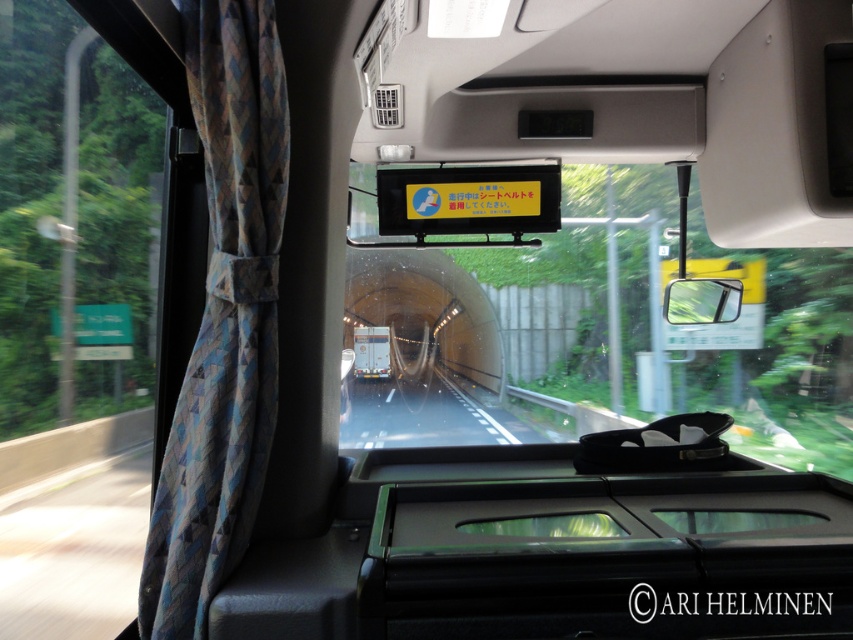
You are a passenger sitting in the bus and looking through the windshield. There are two points marked on the windshield at coordinates point (753, 282) and point (123, 227). Which point is closer to you?

Point (753, 282) is closer to the camera than point (123, 227).

You are a passenger sitting in the middle seat of the bus. You want to look outside through the transparent glass windshield at center and the transparent glass window at left. Which one would you look through to see the tunnel entrance first?

The transparent glass windshield at center is in front of the transparent glass window at left, so you would see the tunnel entrance first through the transparent glass windshield at center.

You are a passenger sitting in the bus and want to see the outside view. Which object, the transparent glass window at left or the blue fabric curtain at left, allows you to see the outside better?

The transparent glass window at left allows you to see the outside better because it is located below the blue fabric curtain at left, which may block the view if not fully opened.